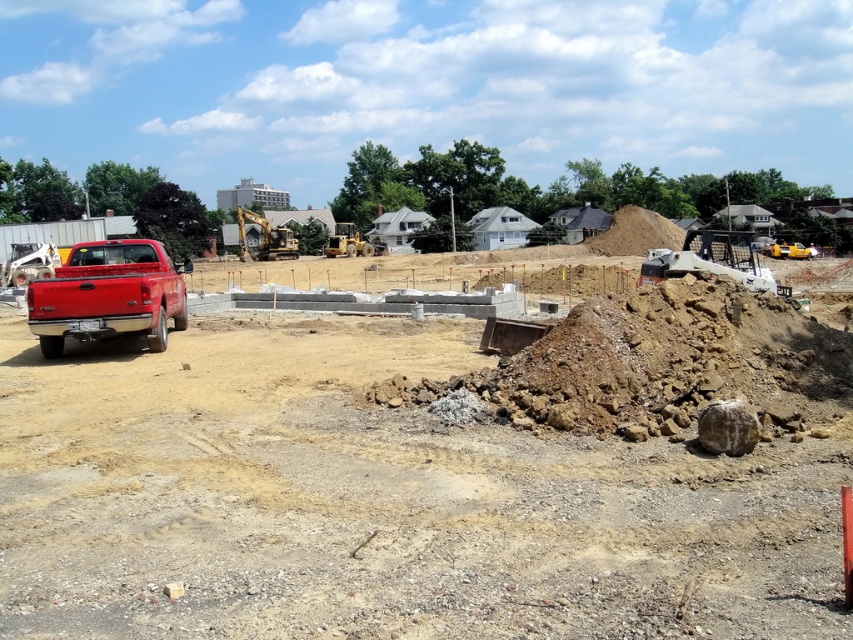
Question: Which point appears closest to the camera in this image?

Choices:
 (A) (152, 339)
 (B) (671, 269)
 (C) (274, 230)

Answer: (A)

Question: Is matte red truck at left bigger than yellow metallic excavator at center?

Choices:
 (A) yes
 (B) no

Answer: (B)

Question: Which object appears farthest from the camera in this image?

Choices:
 (A) metallic silver excavator at right
 (B) matte red truck at left

Answer: (B)

Question: Which point is farther from the camera taking this photo?

Choices:
 (A) (239, 230)
 (B) (701, 240)

Answer: (A)

Question: Can you confirm if metallic silver excavator at right is positioned to the left of yellow metallic excavator at center?

Choices:
 (A) yes
 (B) no

Answer: (B)

Question: Is matte red truck at left to the left of yellow metallic excavator at center from the viewer's perspective?

Choices:
 (A) yes
 (B) no

Answer: (B)